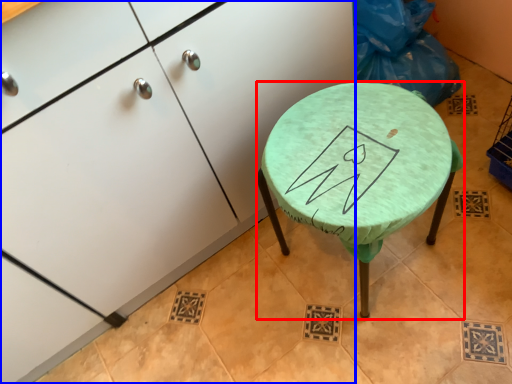
Question: Which object is further to the camera taking this photo, stool (highlighted by a red box) or cabinetry (highlighted by a blue box)?

Choices:
 (A) stool
 (B) cabinetry

Answer: (A)